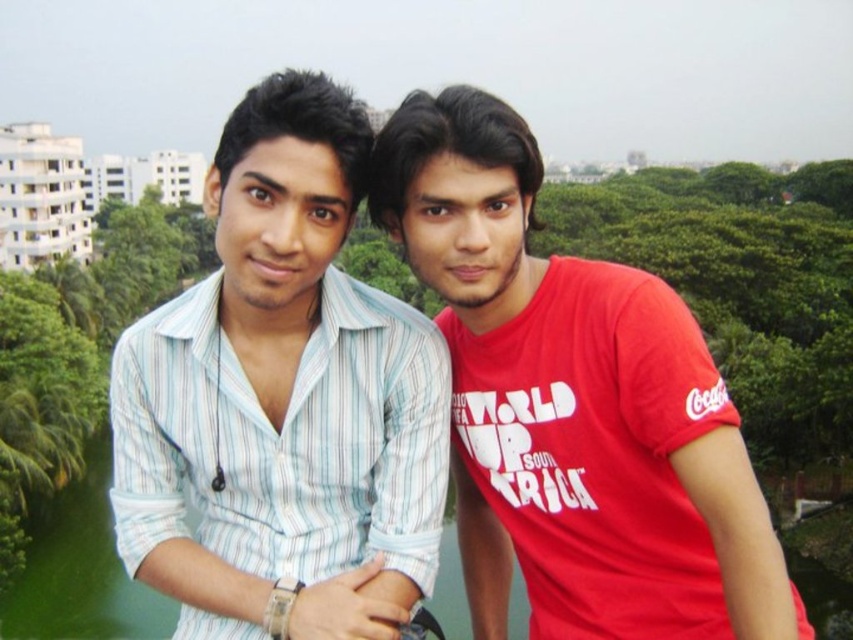
Is light blue striped shirt at center smaller than matte red t-shirt at right?

Incorrect, light blue striped shirt at center is not smaller in size than matte red t-shirt at right.

This screenshot has height=640, width=853. What do you see at coordinates (283, 401) in the screenshot?
I see `light blue striped shirt at center` at bounding box center [283, 401].

The height and width of the screenshot is (640, 853). Identify the location of light blue striped shirt at center. (283, 401).